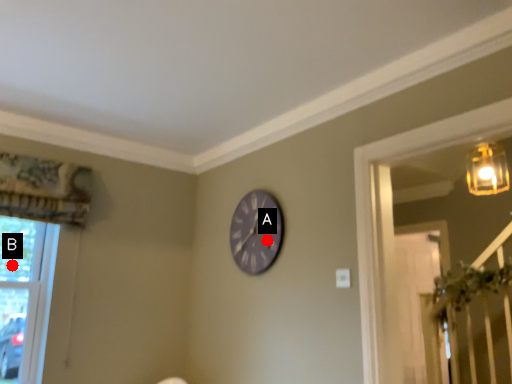
Question: Two points are circled on the image, labeled by A and B beside each circle. Among these points, which one is nearest to the camera?

Choices:
 (A) A is closer
 (B) B is closer

Answer: (A)